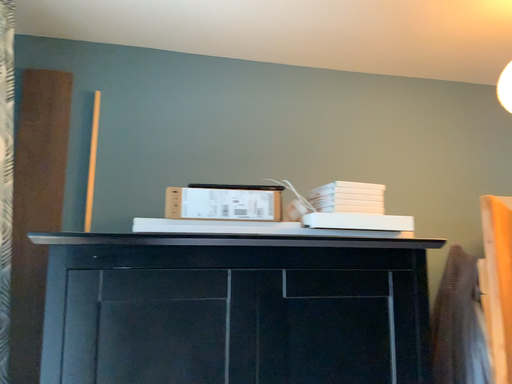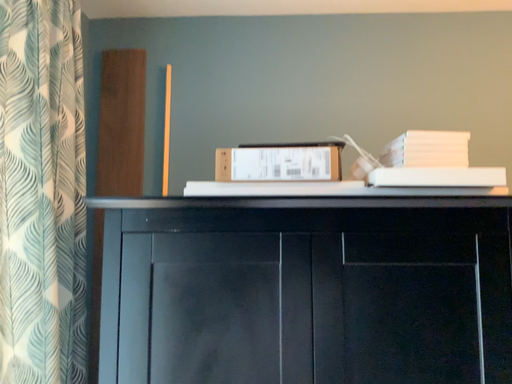
Question: Which way did the camera rotate in the video?

Choices:
 (A) rotated left
 (B) rotated right

Answer: (A)